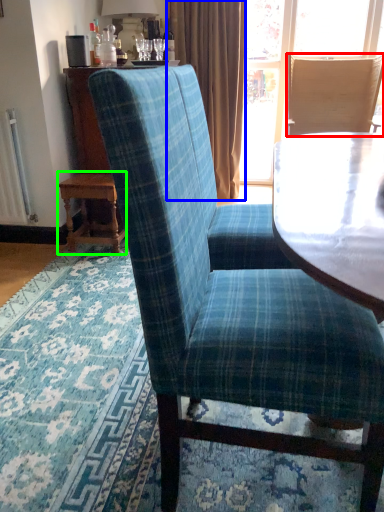
Question: Which is nearer to the chair (highlighted by a red box)? curtain (highlighted by a blue box) or table (highlighted by a green box).

Choices:
 (A) curtain
 (B) table

Answer: (A)